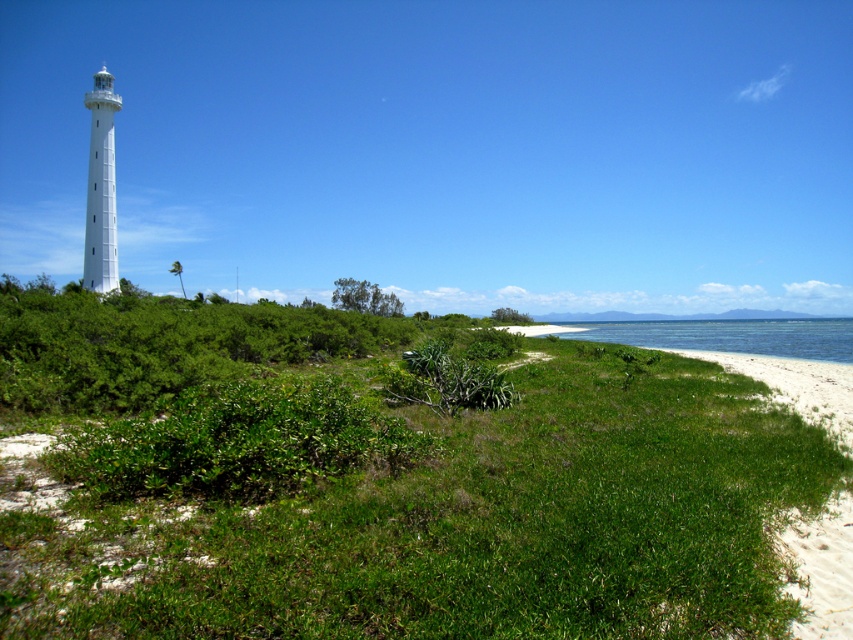
Is green leafy grass at center taller than clear blue water at lower right?

No, green leafy grass at center is not taller than clear blue water at lower right.

Who is shorter, green leafy grass at center or clear blue water at lower right?

With less height is green leafy grass at center.

This screenshot has height=640, width=853. I want to click on green leafy grass at center, so [463, 522].

Can you confirm if green leafy shrubs at center is positioned below clear blue water at lower right?

No.

Does green leafy shrubs at center have a lesser height compared to clear blue water at lower right?

In fact, green leafy shrubs at center may be taller than clear blue water at lower right.

I want to click on green leafy shrubs at center, so click(161, 344).

The width and height of the screenshot is (853, 640). In order to click on green leafy shrubs at center in this screenshot , I will do [161, 344].

Is green leafy grass at center wider than white smooth lighthouse at left?

Correct, the width of green leafy grass at center exceeds that of white smooth lighthouse at left.

Measure the distance from green leafy grass at center to white smooth lighthouse at left.

green leafy grass at center and white smooth lighthouse at left are 224.51 feet apart.

Is point (621, 628) farther from viewer compared to point (103, 170)?

No, (621, 628) is closer to viewer.

Find the location of `green leafy grass at center`. green leafy grass at center is located at coordinates (463, 522).